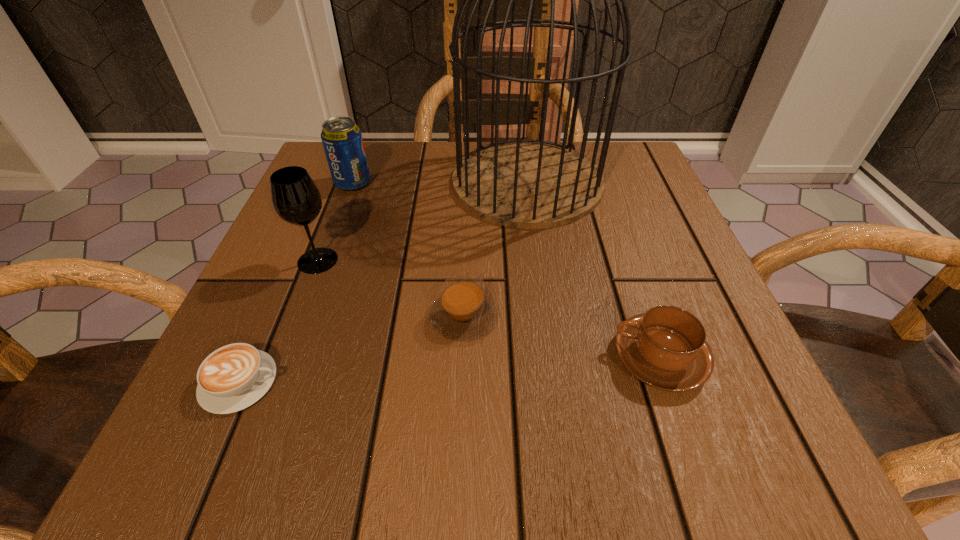
Identify the location of vacant space that satisfies the following two spatial constraints: 1. on the front side of the second cappuccino from right to left; 2. on the left side of the third tallest object. (303, 317).